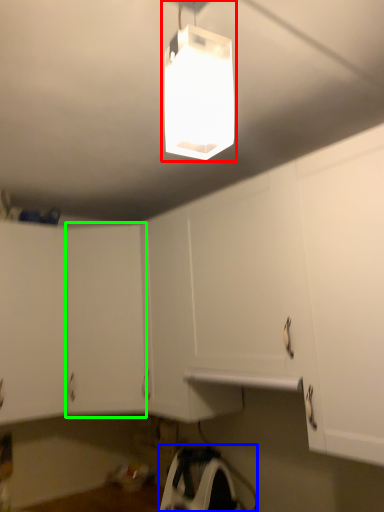
Question: Which object is positioned farthest from lamp (highlighted by a red box)? Select from appliance (highlighted by a blue box) and cabinetry (highlighted by a green box).

Choices:
 (A) appliance
 (B) cabinetry

Answer: (A)